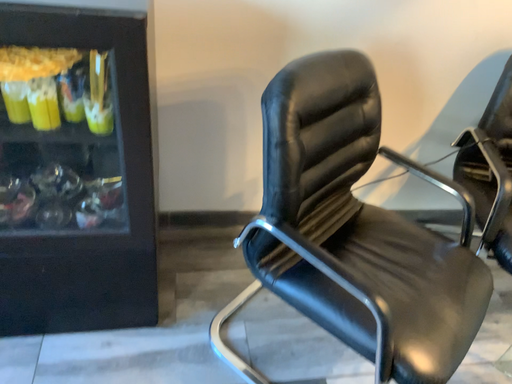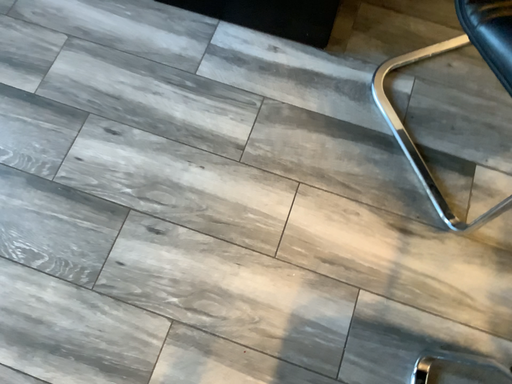
Question: Which way did the camera rotate in the video?

Choices:
 (A) rotated upward
 (B) rotated downward

Answer: (B)